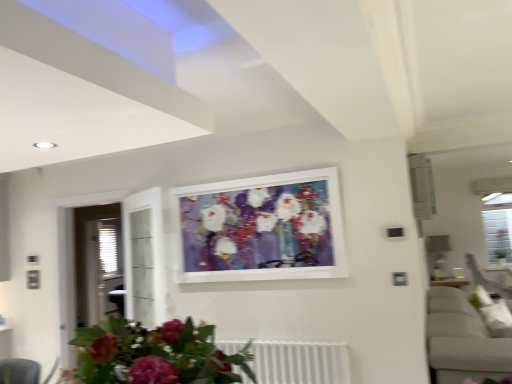
Question: Can you confirm if white metallic radiator at lower center is taller than matte white picture frame at center?

Choices:
 (A) yes
 (B) no

Answer: (B)

Question: Is white metallic radiator at lower center oriented away from matte white picture frame at center?

Choices:
 (A) yes
 (B) no

Answer: (B)

Question: Considering the relative sizes of white metallic radiator at lower center and matte white picture frame at center in the image provided, is white metallic radiator at lower center wider than matte white picture frame at center?

Choices:
 (A) yes
 (B) no

Answer: (A)

Question: Could you tell me if white metallic radiator at lower center is turned towards matte white picture frame at center?

Choices:
 (A) yes
 (B) no

Answer: (B)

Question: From the image's perspective, does white metallic radiator at lower center appear lower than matte white picture frame at center?

Choices:
 (A) yes
 (B) no

Answer: (A)

Question: Relative to matte white picture frame at center, is matte pink flowers at lower center in front or behind?

Choices:
 (A) behind
 (B) front

Answer: (B)

Question: Based on their positions, is matte pink flowers at lower center located to the left or right of matte white picture frame at center?

Choices:
 (A) right
 (B) left

Answer: (B)

Question: Is point (150, 350) positioned closer to the camera than point (317, 254)?

Choices:
 (A) farther
 (B) closer

Answer: (B)

Question: From the image's perspective, is matte pink flowers at lower center positioned above or below matte white picture frame at center?

Choices:
 (A) above
 (B) below

Answer: (B)

Question: Is matte white picture frame at center to the left or to the right of white metallic radiator at lower center in the image?

Choices:
 (A) left
 (B) right

Answer: (A)

Question: Considering the positions of matte white picture frame at center and white metallic radiator at lower center in the image, is matte white picture frame at center taller or shorter than white metallic radiator at lower center?

Choices:
 (A) tall
 (B) short

Answer: (A)

Question: Is matte white picture frame at center in front of or behind white metallic radiator at lower center in the image?

Choices:
 (A) behind
 (B) front

Answer: (A)

Question: Looking at their shapes, would you say matte white picture frame at center is wider or thinner than white metallic radiator at lower center?

Choices:
 (A) thin
 (B) wide

Answer: (A)

Question: In terms of height, does matte pink flowers at lower center look taller or shorter compared to white metallic radiator at lower center?

Choices:
 (A) short
 (B) tall

Answer: (A)

Question: Based on their sizes in the image, would you say matte pink flowers at lower center is bigger or smaller than white metallic radiator at lower center?

Choices:
 (A) small
 (B) big

Answer: (B)